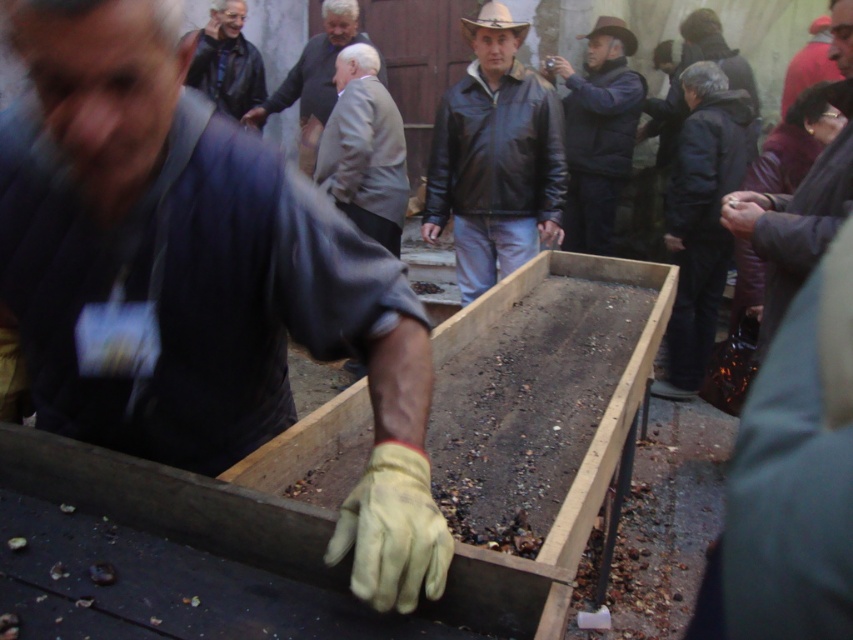
Does yellow leather glove at center have a greater height compared to light gray suit at center?

No, yellow leather glove at center is not taller than light gray suit at center.

Is point (383, 552) farther from viewer compared to point (337, 52)?

No, it is not.

Locate an element on the screen. The height and width of the screenshot is (640, 853). yellow leather glove at center is located at coordinates pos(392,531).

Can you confirm if yellow leather glove at lower center is taller than dark brown leather jacket at upper right?

In fact, yellow leather glove at lower center may be shorter than dark brown leather jacket at upper right.

Who is more distant from viewer, (187, 365) or (607, 157)?

The point (607, 157) is behind.

At what (x,y) coordinates should I click in order to perform the action: click on yellow leather glove at lower center. Please return your answer as a coordinate pair (x, y). This screenshot has width=853, height=640. Looking at the image, I should click on (198, 280).

In the scene shown: Who is positioned more to the right, yellow leather glove at lower center or leather jacket at center?

Positioned to the right is leather jacket at center.

Based on the photo, between yellow leather glove at lower center and leather jacket at center, which one has less height?

yellow leather glove at lower center

This screenshot has height=640, width=853. Find the location of `yellow leather glove at lower center`. yellow leather glove at lower center is located at coordinates point(198,280).